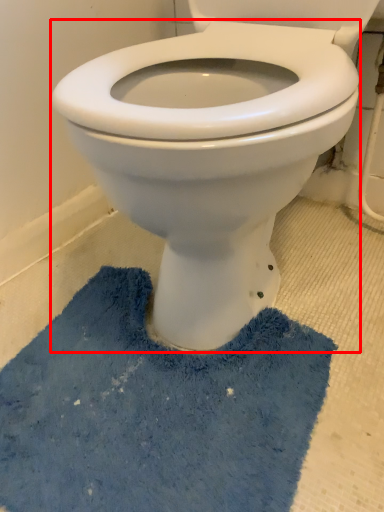
Question: Observing the image, what is the correct spatial positioning of bidet (annotated by the red box) in reference to bath mat?

Choices:
 (A) right
 (B) left

Answer: (A)